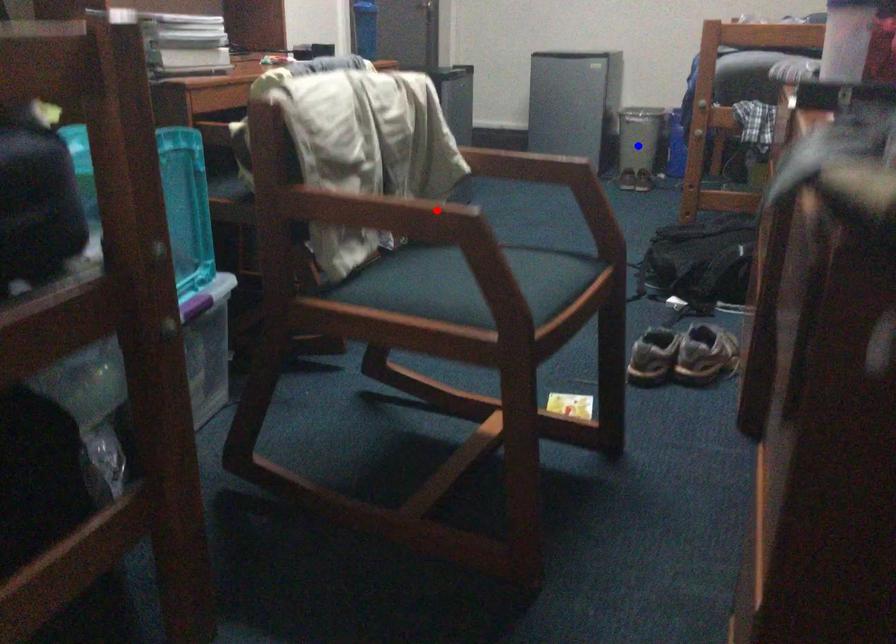
Question: Two points are marked on the image. Which point is closer to the camera?

Choices:
 (A) Blue point is closer.
 (B) Red point is closer.

Answer: (B)